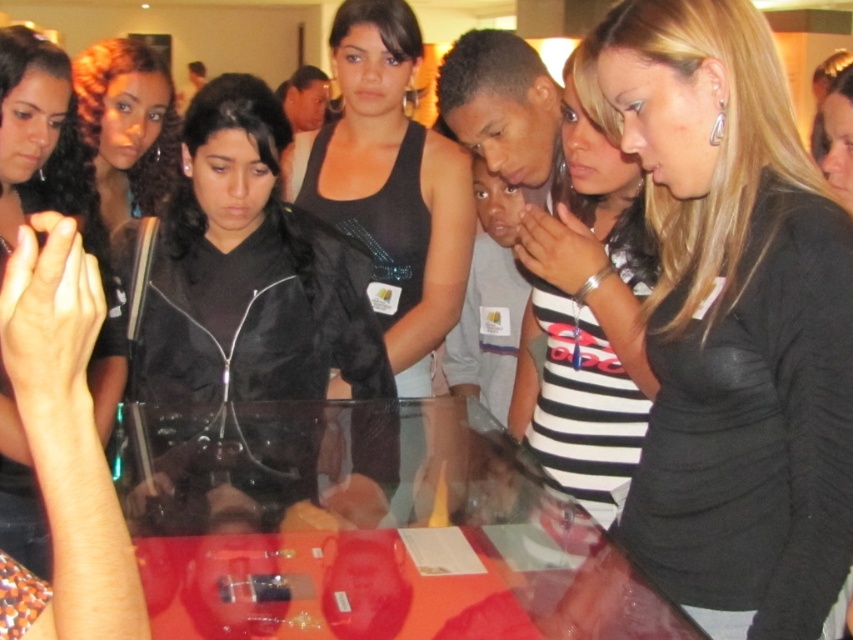
You are a tour guide leading a group at a museum. You notice the black sequined tank top at center and the curly hair at center in the crowd. Which one is closer to the display case?

The curly hair at center is behind the black sequined tank top at center, so the black sequined tank top at center is closer to the display case.

You are a person in the group standing near the transparent glass table at center and the striped jersey at center. Which object is taller?

The striped jersey at center is taller than the transparent glass table at center.